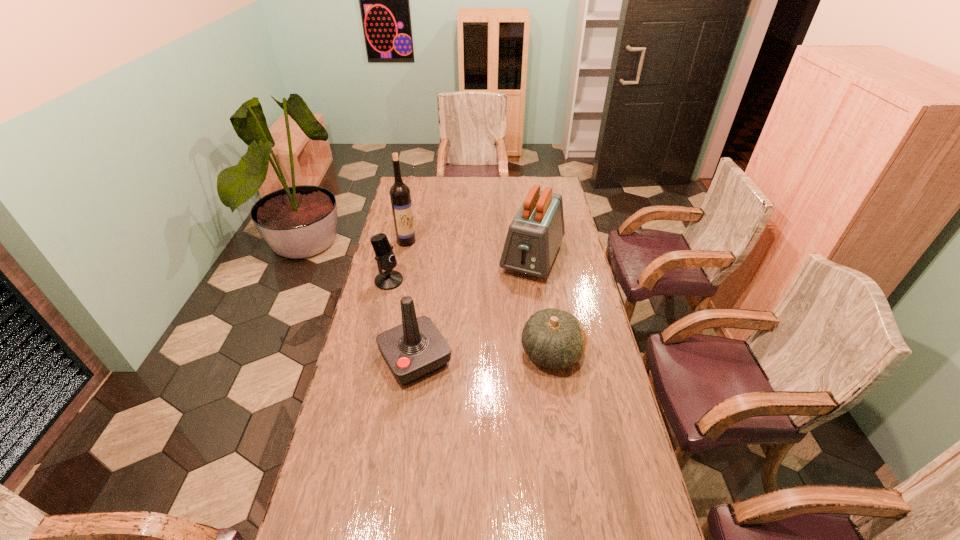
Locate an element on the screen. free spot located on the front-facing side of the toaster is located at coordinates pos(504,326).

Find the location of a particular element. free space located on the front-facing side of the toaster is located at coordinates (504, 326).

At what (x,y) coordinates should I click in order to perform the action: click on free space located on the front-facing side of the toaster. Please return your answer as a coordinate pair (x, y). This screenshot has height=540, width=960. Looking at the image, I should click on (492, 353).

Locate an element on the screen. The width and height of the screenshot is (960, 540). free space located on the label of the wine bottle is located at coordinates (450, 294).

Where is `free location located 0.160m on the label of the wine bottle`? Image resolution: width=960 pixels, height=540 pixels. free location located 0.160m on the label of the wine bottle is located at coordinates (426, 265).

Image resolution: width=960 pixels, height=540 pixels. What are the coordinates of `vacant area situated 0.210m on the label of the wine bottle` in the screenshot? It's located at (431, 271).

Where is `joystick at the left edge`? joystick at the left edge is located at coordinates (416, 348).

Image resolution: width=960 pixels, height=540 pixels. What are the coordinates of `microphone at the left edge` in the screenshot? It's located at (389, 279).

You are a GUI agent. You are given a task and a screenshot of the screen. Output one action in this format:
    pyautogui.click(x=<x>, y=<y>)
    Task: Click on the wine bottle situated at the left edge
    The width and height of the screenshot is (960, 540).
    Given the screenshot: What is the action you would take?
    pyautogui.click(x=400, y=196)

Locate an element on the screen. Image resolution: width=960 pixels, height=540 pixels. gourd that is at the right edge is located at coordinates (552, 338).